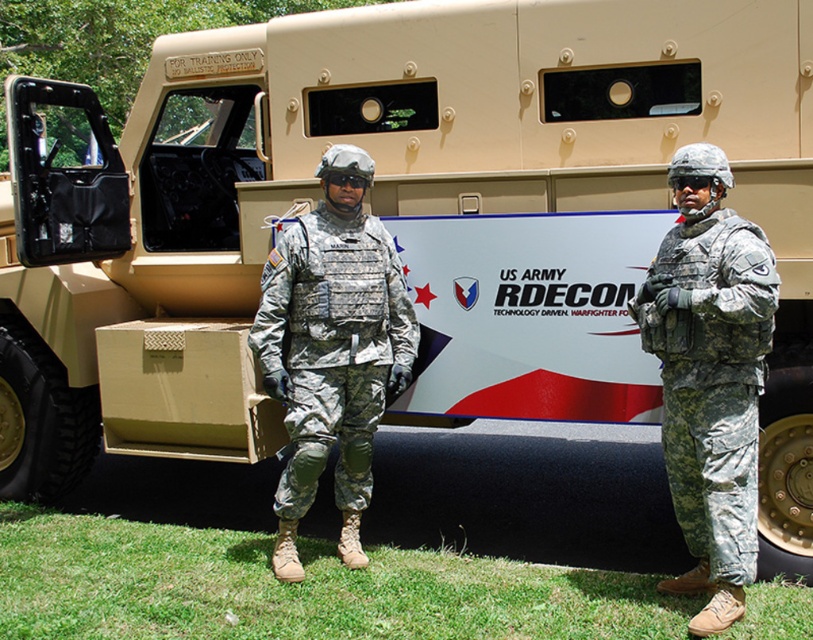
Based on the photo, you are a military tailor who needs to determine which item requires more fabric for a new order. Based on the image, which item has a larger width between the camouflage fabric uniform at right and the camouflage fabric vest at center?

The camouflage fabric vest at center has a greater width than the camouflage fabric uniform at right, so the vest would require more fabric for the new order.

You are a military medic who needs to quickly move from the camouflage fabric uniform at right to the camouflage fabric vest at center to provide assistance. Can you reach the vest within 2 seconds if you walk at a normal pace?

The distance between the camouflage fabric uniform at right and the camouflage fabric vest at center is 5.30 feet. At a normal walking speed of approximately 3 feet per second, it would take about 1.77 seconds to cover this distance. Therefore, yes, you can reach the vest within 2 seconds.

You are a photographer positioned at the scene. You want to take a closeup shot of the camouflage fabric uniform at right without moving your position. Is it possible to do so without zooming in?

The camouflage fabric uniform at right is 3.25 meters away from viewer, so it is possible to take a closeup shot without zooming in as long as the camera has sufficient resolution and the uniform fills the frame appropriately.